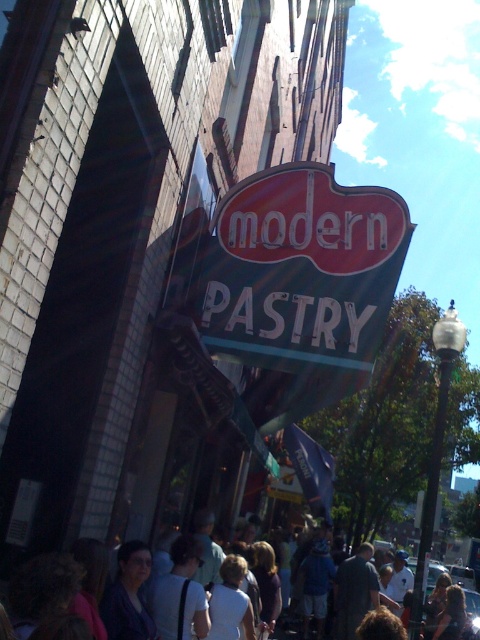
Does red plastic sign at center have a greater height compared to white cotton shirt at center?

Incorrect, red plastic sign at center's height is not larger of white cotton shirt at center's.

Does point (349, 195) come farther from viewer compared to point (470, 600)?

That is False.

Which is behind, point (354, 259) or point (79, 561)?

The point (354, 259) is behind.

Locate an element on the screen. red plastic sign at center is located at coordinates (301, 269).